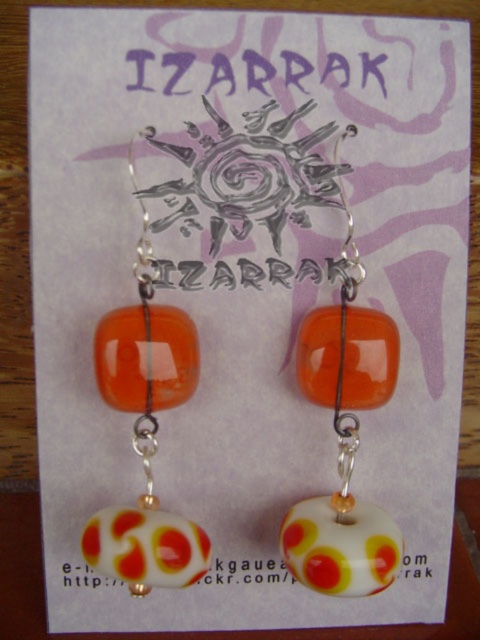
Question: Can you confirm if orange glossy bead at center is bigger than orange glass bead at center?

Choices:
 (A) yes
 (B) no

Answer: (A)

Question: Is orange glossy bead at center further to camera compared to orange glass bead at center?

Choices:
 (A) no
 (B) yes

Answer: (A)

Question: Which point is farther from the camera taking this photo?

Choices:
 (A) (342, 566)
 (B) (170, 396)

Answer: (B)

Question: Observing the image, what is the correct spatial positioning of orange glossy bead at center in reference to orange glass bead at center?

Choices:
 (A) below
 (B) above

Answer: (B)

Question: Among these objects, which one is farthest from the camera?

Choices:
 (A) orange glossy bead at center
 (B) orange glass bead at center

Answer: (B)